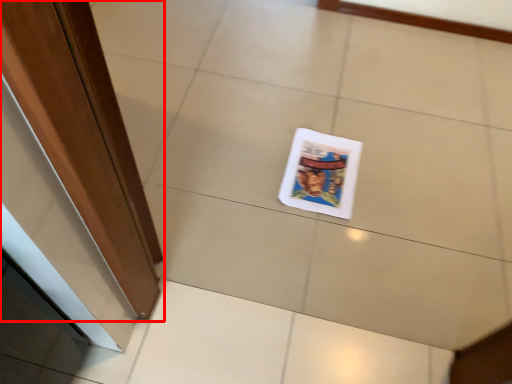
Question: From the image's perspective, what is the correct spatial relationship of door (annotated by the red box) in relation to magazine?

Choices:
 (A) above
 (B) below

Answer: (A)